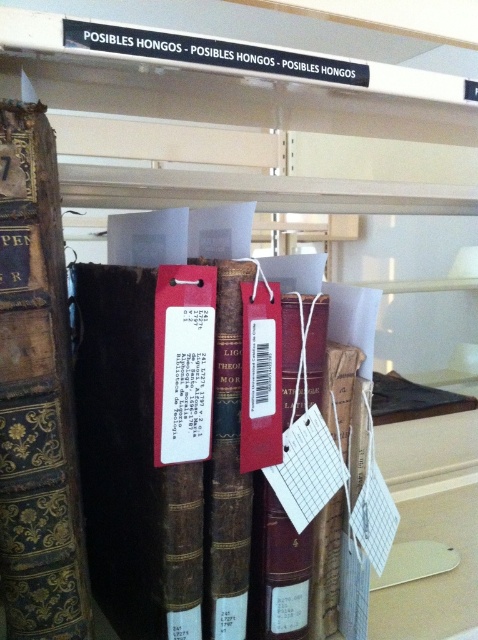
You are a librarian organizing books on a shelf. You have two books to place correctly based on their positions. The brown leather book at center and the gold embossed leather book at left. Which book should you place to the right of the other?

The brown leather book at center should be placed to the right of the gold embossed leather book at left because the description states that the brown leather book at center is to the right of the gold embossed leather book at left.

You are a librarian who needs to retrieve a book from the shelf. You see the brown leather book at center and the gold embossed leather book at left. Which book is closer to you?

The brown leather book at center is closer to you because it is further to the viewer than the gold embossed leather book at left.

You are a librarian who needs to retrieve a book from the shelf. You are standing 24 inches away from the brown leather book at center. Can you reach it without moving closer? Please explain your reasoning.

The brown leather book at center is 24.59 inches away from the viewer. Since you are standing 24 inches away, you are still 0.59 inches too far to reach it without moving closer. Therefore, you need to move a little closer to retrieve the book.